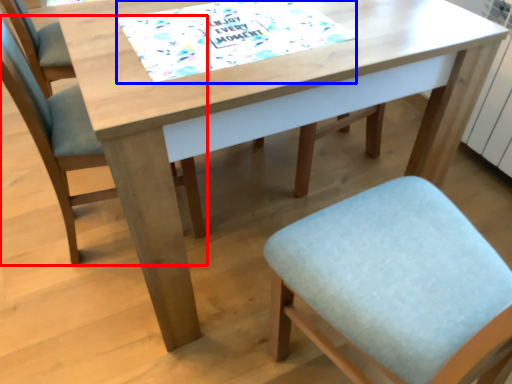
Question: Which of the following is the closest to the observer, chair (highlighted by a red box) or place mat (highlighted by a blue box)?

Choices:
 (A) chair
 (B) place mat

Answer: (B)